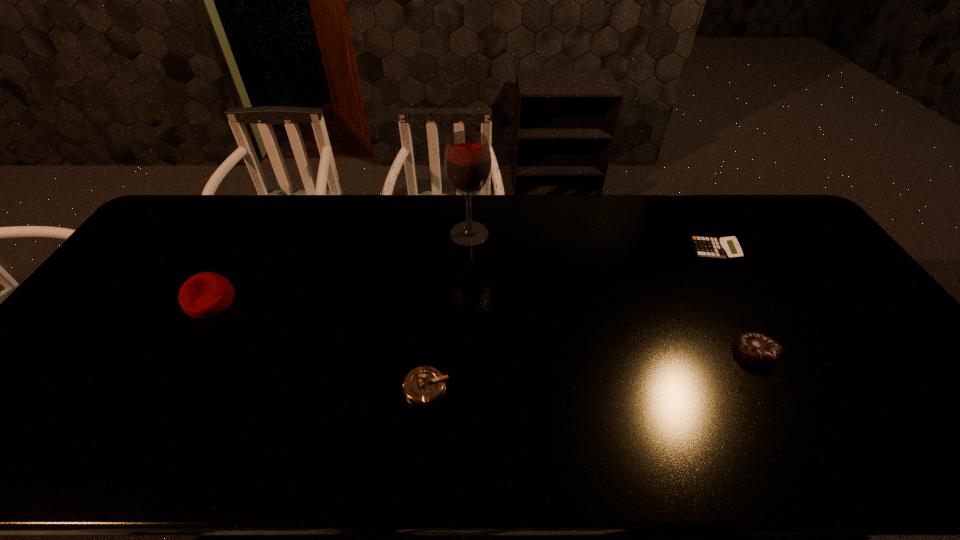
Where is `the tallest object`? This screenshot has width=960, height=540. the tallest object is located at coordinates (467, 159).

I want to click on the taller beanbag, so click(x=203, y=295).

This screenshot has height=540, width=960. Find the location of `the left beanbag`. the left beanbag is located at coordinates (203, 295).

Find the location of `the third tallest object`. the third tallest object is located at coordinates (757, 350).

The height and width of the screenshot is (540, 960). I want to click on the nearer beanbag, so click(757, 350).

You are a GUI agent. You are given a task and a screenshot of the screen. Output one action in this format:
    pyautogui.click(x=<x>, y=<y>)
    Task: Click on the calculator
    The width and height of the screenshot is (960, 540).
    Given the screenshot: What is the action you would take?
    pyautogui.click(x=728, y=248)

The width and height of the screenshot is (960, 540). What are the coordinates of `ashtray` in the screenshot? It's located at (423, 385).

Identify the location of vacant space located on the right of the tallest object. (585, 234).

Where is `free space located 0.140m on the seat area of the taller beanbag`? This screenshot has height=540, width=960. free space located 0.140m on the seat area of the taller beanbag is located at coordinates (175, 362).

Where is `vacant space situated 0.270m on the left of the right beanbag`? The image size is (960, 540). vacant space situated 0.270m on the left of the right beanbag is located at coordinates [631, 353].